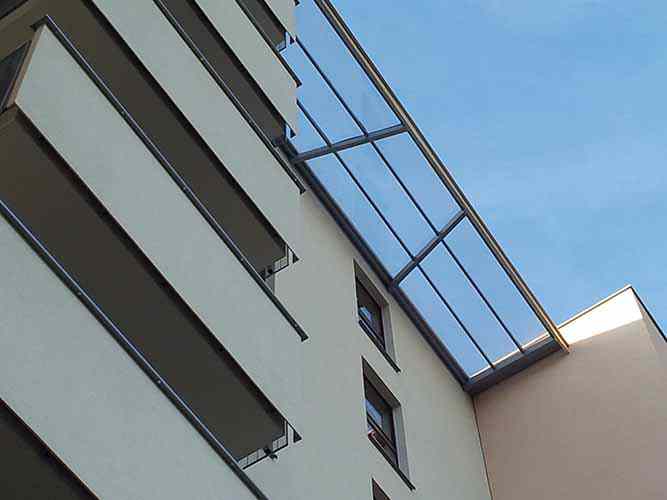
Locate an element on the screen. The height and width of the screenshot is (500, 667). different floors is located at coordinates (91, 379), (143, 189), (235, 108), (279, 67).